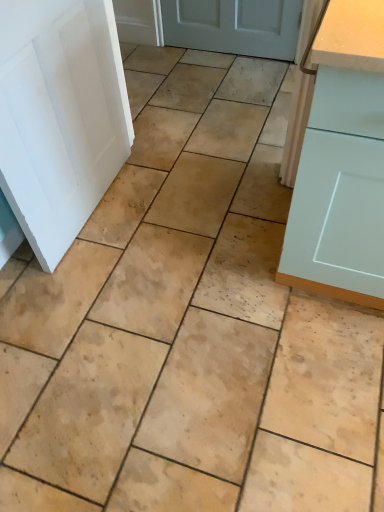
Question: Is light blue matte cabinet at right aimed at white matte door at left?

Choices:
 (A) no
 (B) yes

Answer: (A)

Question: From the image's perspective, is light blue matte cabinet at right under white matte door at left?

Choices:
 (A) no
 (B) yes

Answer: (B)

Question: Is light blue matte cabinet at right to the right of white matte door at left from the viewer's perspective?

Choices:
 (A) yes
 (B) no

Answer: (A)

Question: Are light blue matte cabinet at right and white matte door at left located far from each other?

Choices:
 (A) yes
 (B) no

Answer: (B)

Question: Could white matte door at left be considered to be inside light blue matte cabinet at right?

Choices:
 (A) yes
 (B) no

Answer: (B)

Question: Is light blue matte cabinet at right bigger than white matte door at left?

Choices:
 (A) no
 (B) yes

Answer: (B)

Question: From the image's perspective, is white matte door at left on light blue matte cabinet at right?

Choices:
 (A) yes
 (B) no

Answer: (A)

Question: Is white matte door at left surrounding light blue matte cabinet at right?

Choices:
 (A) yes
 (B) no

Answer: (B)

Question: Is white matte door at left shorter than light blue matte cabinet at right?

Choices:
 (A) no
 (B) yes

Answer: (B)

Question: Can you confirm if white matte door at left is positioned to the left of light blue matte cabinet at right?

Choices:
 (A) yes
 (B) no

Answer: (A)

Question: From a real-world perspective, is white matte door at left positioned under light blue matte cabinet at right based on gravity?

Choices:
 (A) yes
 (B) no

Answer: (B)

Question: Is white matte door at left completely or partially outside of light blue matte cabinet at right?

Choices:
 (A) no
 (B) yes

Answer: (B)

Question: From a real-world perspective, relative to white matte door at left, is light blue matte cabinet at right vertically above or below?

Choices:
 (A) above
 (B) below

Answer: (B)